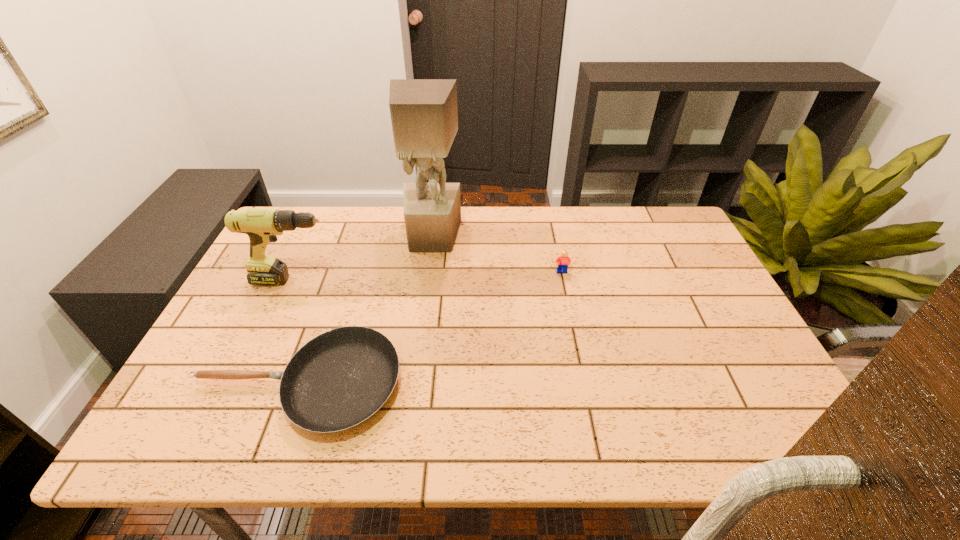
In the image, there is a desktop. Where is `vacant space at the far left corner`? The width and height of the screenshot is (960, 540). vacant space at the far left corner is located at coordinates (317, 224).

Find the location of a particular element. vacant area at the far right corner of the desktop is located at coordinates (665, 212).

This screenshot has height=540, width=960. Identify the location of vacant area between the Lego and the farthest object. (497, 254).

Locate an element on the screen. This screenshot has height=540, width=960. free spot between the rightmost object and the sculpture is located at coordinates (497, 254).

Identify the location of vacant space in between the third shortest object and the farthest object. (364, 258).

At what (x,y) coordinates should I click in order to perform the action: click on vacant space that is in between the sculpture and the shortest object. Please return your answer as a coordinate pair (x, y). The image size is (960, 540). Looking at the image, I should click on (365, 310).

This screenshot has width=960, height=540. I want to click on vacant area that lies between the shortest object and the drill, so click(x=296, y=332).

You are a GUI agent. You are given a task and a screenshot of the screen. Output one action in this format:
    pyautogui.click(x=<x>, y=<y>)
    Task: Click on the vacant point located between the drill and the Lego
    
    Given the screenshot: What is the action you would take?
    pyautogui.click(x=428, y=276)

What are the coordinates of `free space between the second tallest object and the Lego` in the screenshot? It's located at point(428,276).

Locate an element on the screen. free spot between the sculpture and the shortest object is located at coordinates (365, 310).